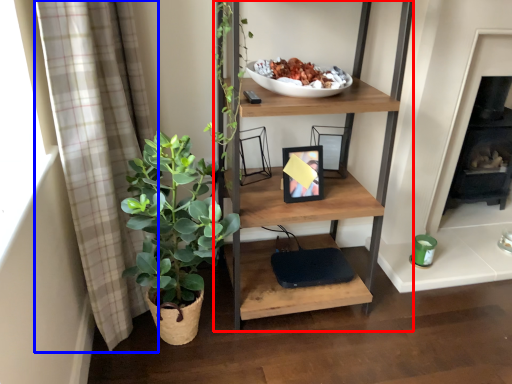
Question: Among these objects, which one is nearest to the camera, shelf (highlighted by a red box) or curtain (highlighted by a blue box)?

Choices:
 (A) shelf
 (B) curtain

Answer: (B)